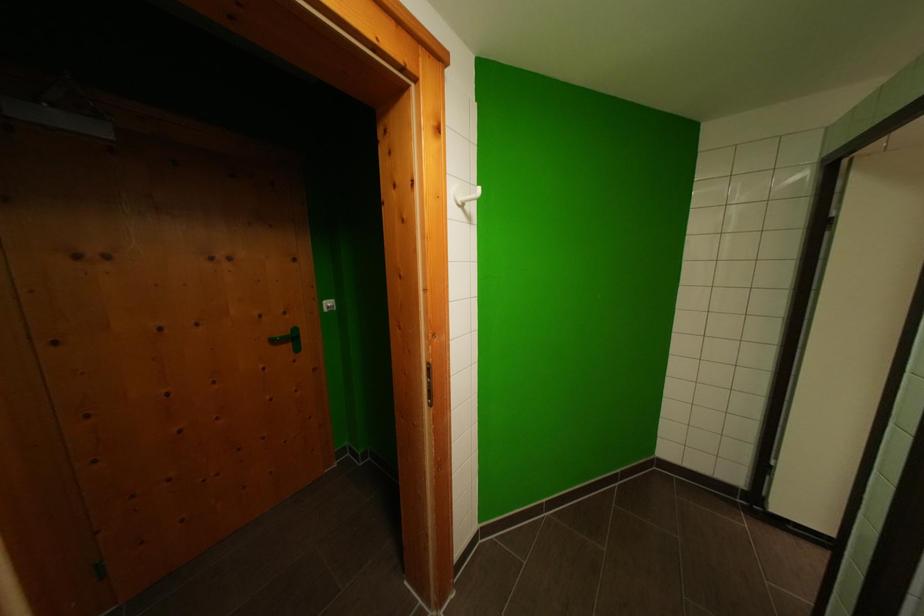
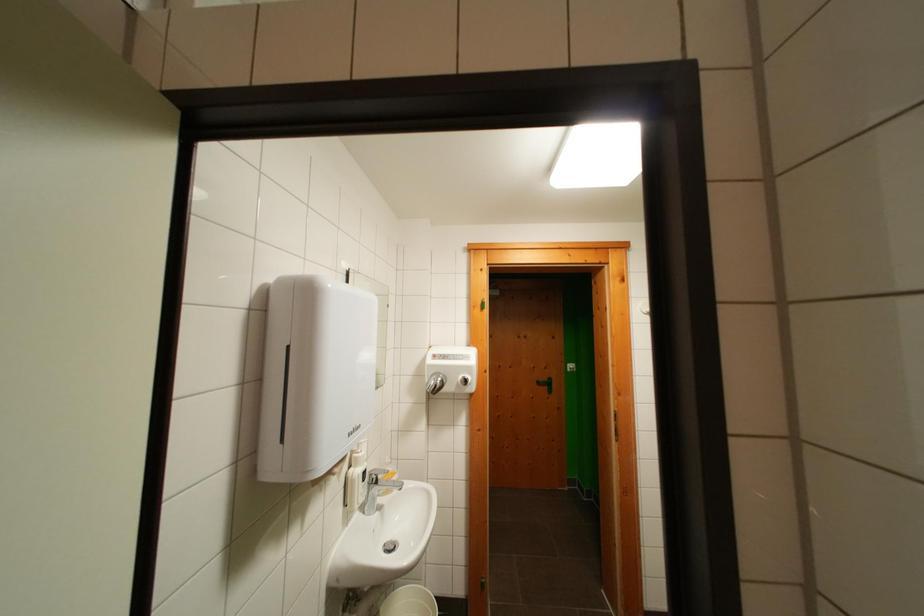
Question: How did the camera likely rotate?

Choices:
 (A) Left
 (B) Right
 (C) Up
 (D) Down

Answer: (A)